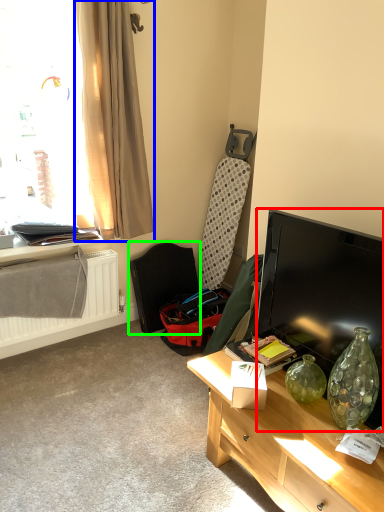
Question: Which is nearer to the television (highlighted by a red box)? curtain (highlighted by a blue box) or swivel chair (highlighted by a green box).

Choices:
 (A) curtain
 (B) swivel chair

Answer: (A)